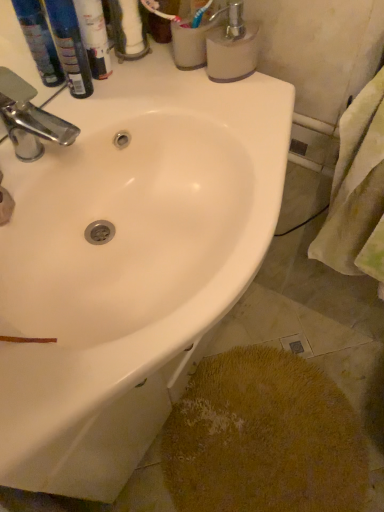
Question: From the image's perspective, is yellow textured rug at lower right on chrome metallic faucet at upper left?

Choices:
 (A) no
 (B) yes

Answer: (A)

Question: Is yellow textured rug at lower right to the right of chrome metallic faucet at upper left from the viewer's perspective?

Choices:
 (A) no
 (B) yes

Answer: (B)

Question: Is yellow textured rug at lower right oriented away from chrome metallic faucet at upper left?

Choices:
 (A) no
 (B) yes

Answer: (A)

Question: Does yellow textured rug at lower right have a lesser height compared to chrome metallic faucet at upper left?

Choices:
 (A) yes
 (B) no

Answer: (A)

Question: Can you confirm if yellow textured rug at lower right is positioned to the left of chrome metallic faucet at upper left?

Choices:
 (A) no
 (B) yes

Answer: (A)

Question: Considering the positions of white glossy tube at upper left, acting as the 2th toiletry starting from the left, and chrome metallic faucet at upper left in the image, is white glossy tube at upper left, acting as the 2th toiletry starting from the left, taller or shorter than chrome metallic faucet at upper left?

Choices:
 (A) short
 (B) tall

Answer: (B)

Question: In terms of width, does white glossy tube at upper left, acting as the 2th toiletry starting from the left, look wider or thinner when compared to chrome metallic faucet at upper left?

Choices:
 (A) wide
 (B) thin

Answer: (B)

Question: From the image's perspective, is white glossy tube at upper left, placed as the 1th toiletry when sorted from right to left, positioned above or below chrome metallic faucet at upper left?

Choices:
 (A) above
 (B) below

Answer: (A)

Question: Is white glossy tube at upper left, acting as the 2th toiletry starting from the left, bigger or smaller than chrome metallic faucet at upper left?

Choices:
 (A) small
 (B) big

Answer: (A)

Question: Does point (51, 26) appear closer or farther from the camera than point (64, 133)?

Choices:
 (A) farther
 (B) closer

Answer: (A)

Question: Would you say blue plastic bottles at upper left, marked as the first toiletry in a left-to-right arrangement, is inside or outside chrome metallic faucet at upper left?

Choices:
 (A) inside
 (B) outside

Answer: (B)

Question: From the image's perspective, relative to chrome metallic faucet at upper left, is blue plastic bottles at upper left, which is the 2th toiletry in right-to-left order, above or below?

Choices:
 (A) above
 (B) below

Answer: (A)

Question: From their relative heights in the image, would you say blue plastic bottles at upper left, marked as the first toiletry in a left-to-right arrangement, is taller or shorter than chrome metallic faucet at upper left?

Choices:
 (A) tall
 (B) short

Answer: (A)

Question: Would you say white glossy tube at upper left, placed as the 1th toiletry when sorted from right to left, is to the left or to the right of white matte soap dispenser at upper right in the picture?

Choices:
 (A) left
 (B) right

Answer: (A)

Question: Considering the positions of white glossy tube at upper left, acting as the 2th toiletry starting from the left, and white matte soap dispenser at upper right in the image, is white glossy tube at upper left, acting as the 2th toiletry starting from the left, bigger or smaller than white matte soap dispenser at upper right?

Choices:
 (A) big
 (B) small

Answer: (B)